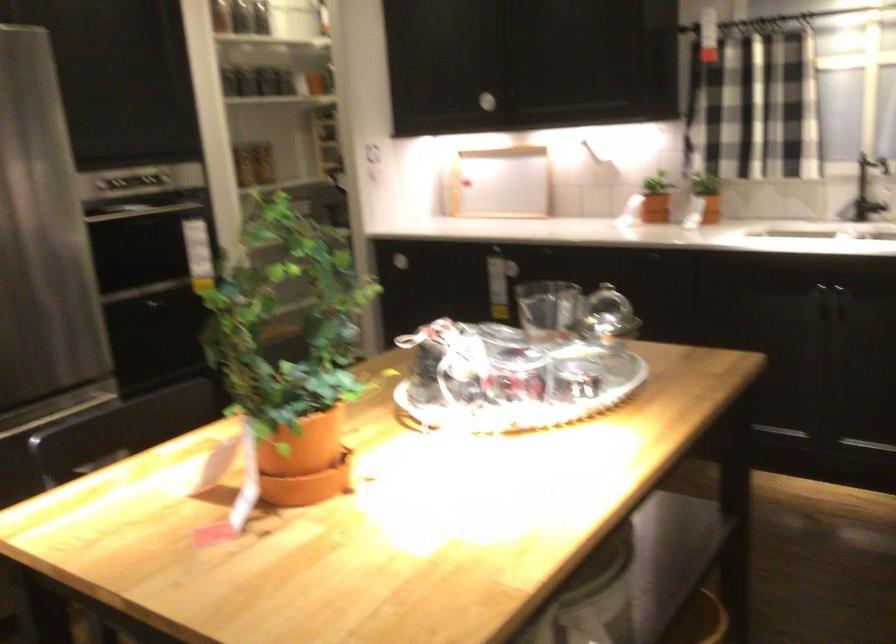
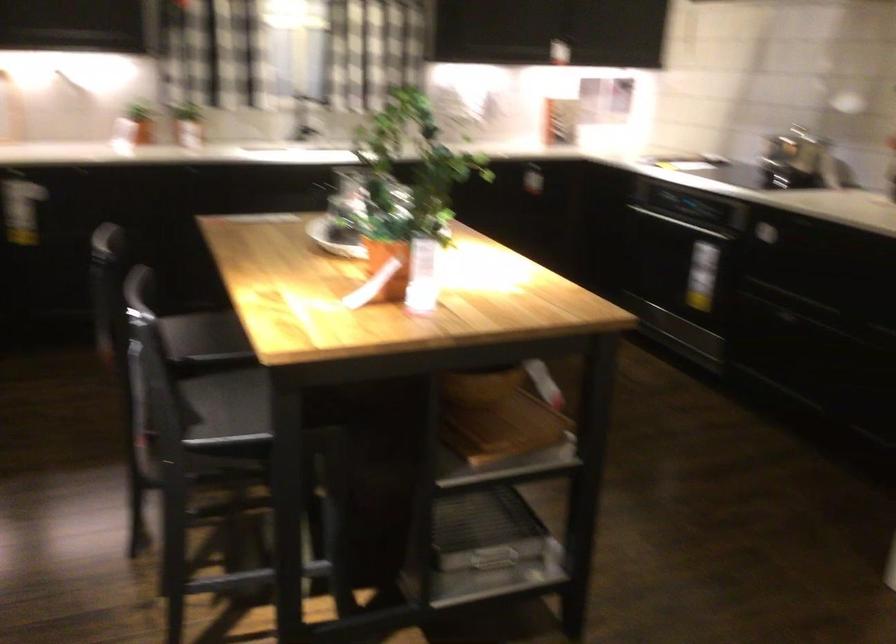
Locate, in the second image, the point that corresponds to the point at 263,489 in the first image.

(424, 275)